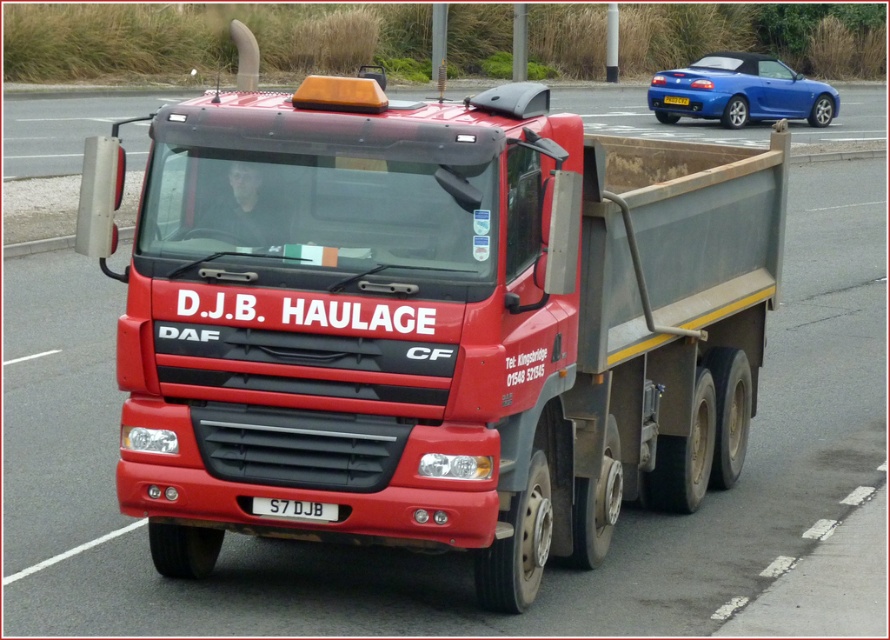
Can you confirm if blue metallic car at upper right is taller than white plastic license plate at center?

Correct, blue metallic car at upper right is much taller as white plastic license plate at center.

Where is `blue metallic car at upper right`? The width and height of the screenshot is (890, 640). blue metallic car at upper right is located at coordinates (740, 92).

This screenshot has width=890, height=640. I want to click on blue metallic car at upper right, so click(x=740, y=92).

Between matte red truck at center and blue metallic car at upper right, which one is positioned higher?

blue metallic car at upper right is higher up.

Looking at this image, does matte red truck at center have a greater height compared to blue metallic car at upper right?

No, matte red truck at center is not taller than blue metallic car at upper right.

Find the location of a particular element. This screenshot has height=640, width=890. matte red truck at center is located at coordinates (430, 323).

Which is more to the right, matte red truck at center or white plastic license plate at center?

matte red truck at center

Does matte red truck at center have a greater height compared to white plastic license plate at center?

Yes, matte red truck at center is taller than white plastic license plate at center.

Which is in front, point (332, 282) or point (292, 500)?

Point (332, 282) is more forward.

Identify the location of matte red truck at center. (430, 323).